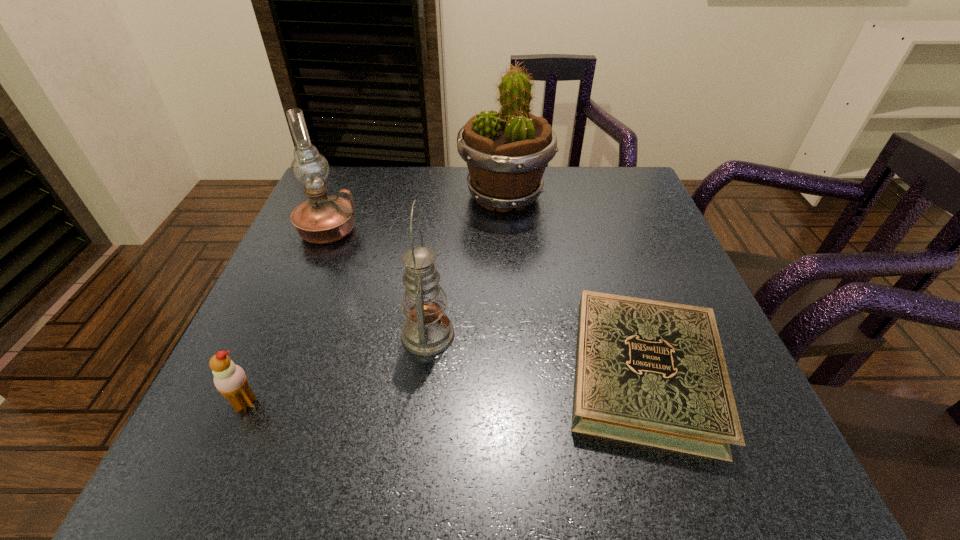
Locate an element on the screen. The height and width of the screenshot is (540, 960). free space at the right edge is located at coordinates (613, 225).

The height and width of the screenshot is (540, 960). Identify the location of vacant region at the far left corner of the desktop. (370, 195).

The height and width of the screenshot is (540, 960). I want to click on vacant space at the far right corner, so click(631, 192).

Locate an element on the screen. The height and width of the screenshot is (540, 960). vacant space in between the flowerpot and the farther oil lamp is located at coordinates (417, 213).

Identify the location of blank region between the shortest object and the icecream. This screenshot has width=960, height=540. (445, 388).

Find the location of a particular element. free space between the farther oil lamp and the nearer oil lamp is located at coordinates (378, 283).

At what (x,y) coordinates should I click in order to perform the action: click on blank region between the hardback book and the flowerpot. Please return your answer as a coordinate pair (x, y). This screenshot has height=540, width=960. Looking at the image, I should click on (574, 285).

Locate an element on the screen. empty location between the right oil lamp and the shortest object is located at coordinates (537, 354).

Locate an element on the screen. The height and width of the screenshot is (540, 960). vacant region between the flowerpot and the farther oil lamp is located at coordinates (417, 213).

At what (x,y) coordinates should I click in order to perform the action: click on free point between the left oil lamp and the nearer oil lamp. Please return your answer as a coordinate pair (x, y). The image size is (960, 540). Looking at the image, I should click on (378, 283).